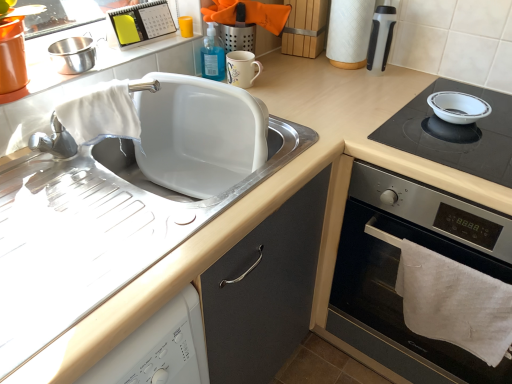
The height and width of the screenshot is (384, 512). I want to click on free space in front of white paper towel at upper right, so (x=349, y=90).